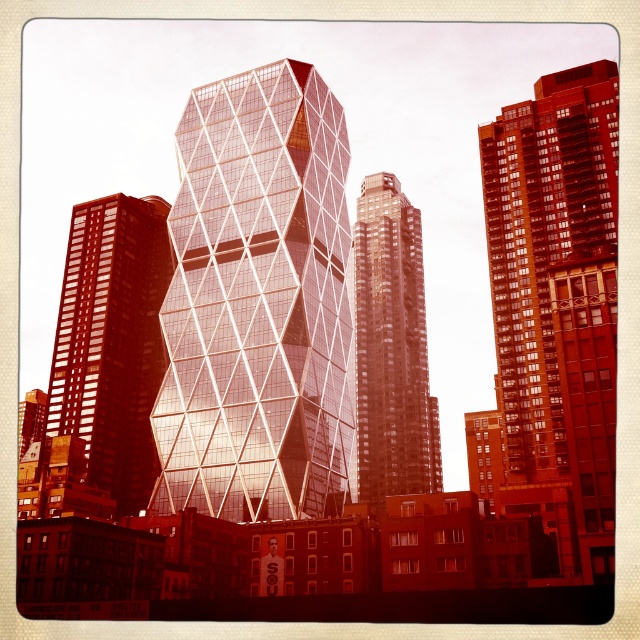
Question: Among these objects, which one is farthest from the camera?

Choices:
 (A) matte glass tower at left
 (B) glassy reflective building at center
 (C) matte glass building at right

Answer: (A)

Question: Can you confirm if matte glass tower at left is wider than glossy glass skyscraper at center?

Choices:
 (A) yes
 (B) no

Answer: (A)

Question: Does matte glass building at right have a smaller size compared to glossy glass skyscraper at center?

Choices:
 (A) yes
 (B) no

Answer: (B)

Question: Which of the following is the closest to the observer?

Choices:
 (A) (403, 474)
 (B) (211, 140)
 (C) (509, 456)

Answer: (C)

Question: Which of the following is the closest to the observer?

Choices:
 (A) matte glass building at right
 (B) glassy reflective building at center
 (C) matte glass tower at left
 (D) glossy glass skyscraper at center

Answer: (A)

Question: Does matte glass building at right have a smaller size compared to glossy glass skyscraper at center?

Choices:
 (A) no
 (B) yes

Answer: (A)